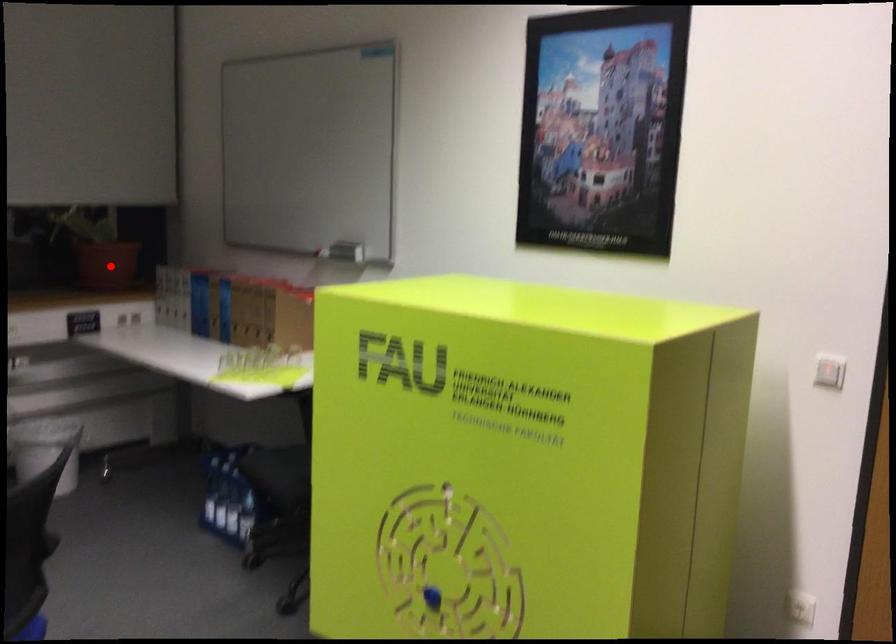
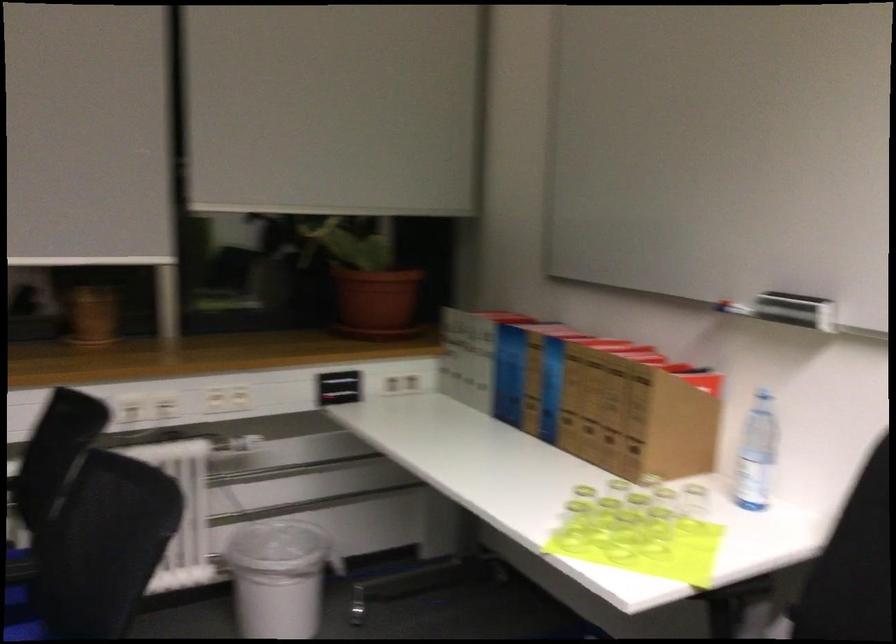
Question: I am providing you with two images of the same scene from different viewpoints. A red point is shown in image1. For the corresponding object point in image2, is it positioned nearer or farther from the camera?

Choices:
 (A) Nearer
 (B) Farther

Answer: (A)